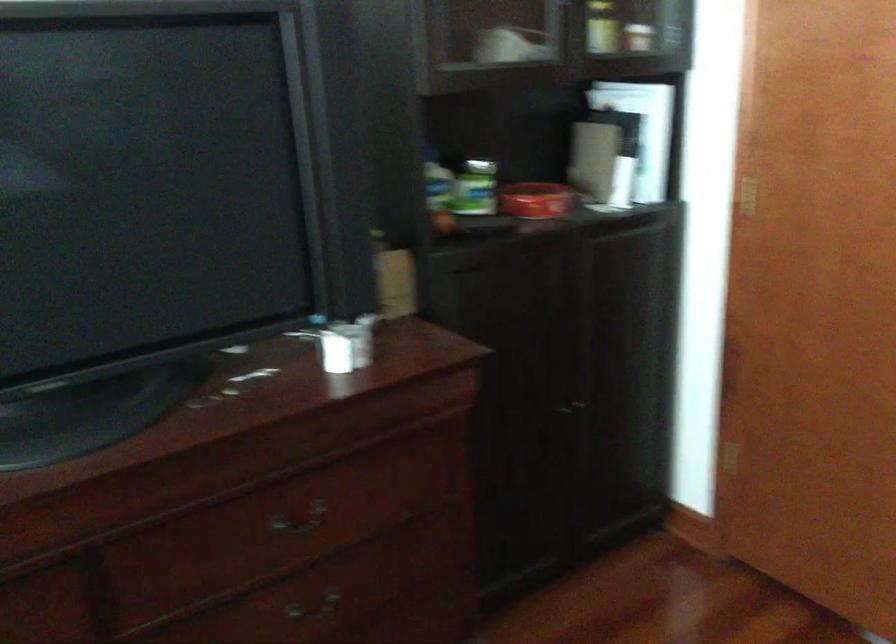
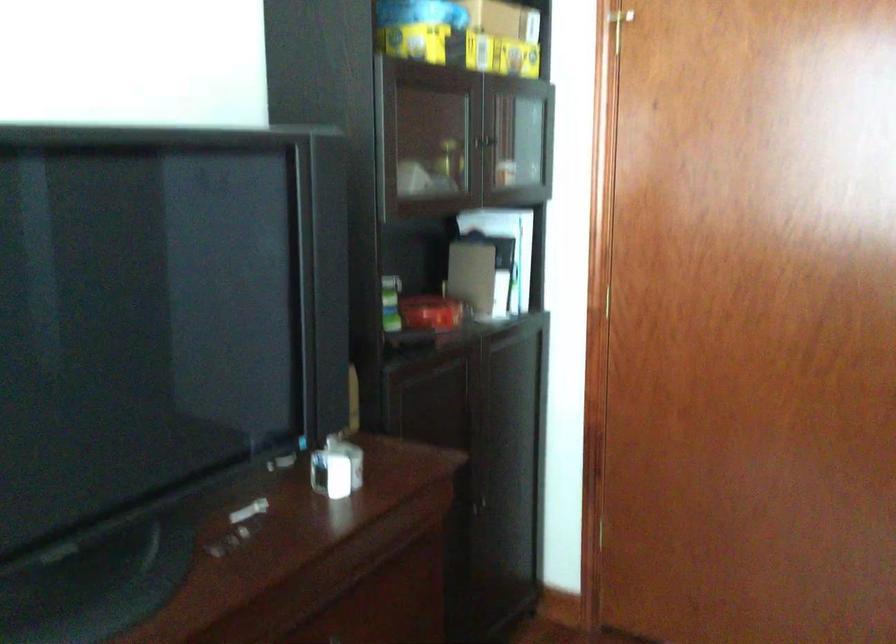
Find the pixel in the second image that matches the point at 530,199 in the first image.

(431, 313)